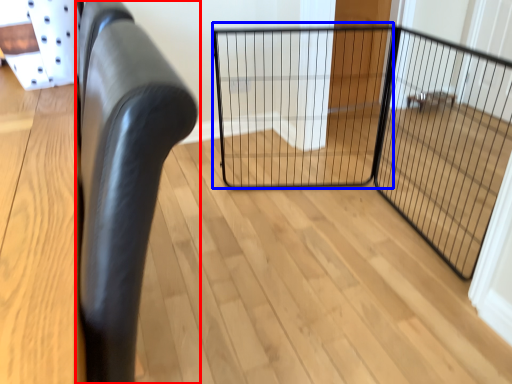
Question: Which of the following is the closest to the observer, furniture (highlighted by a red box) or cage (highlighted by a blue box)?

Choices:
 (A) furniture
 (B) cage

Answer: (A)